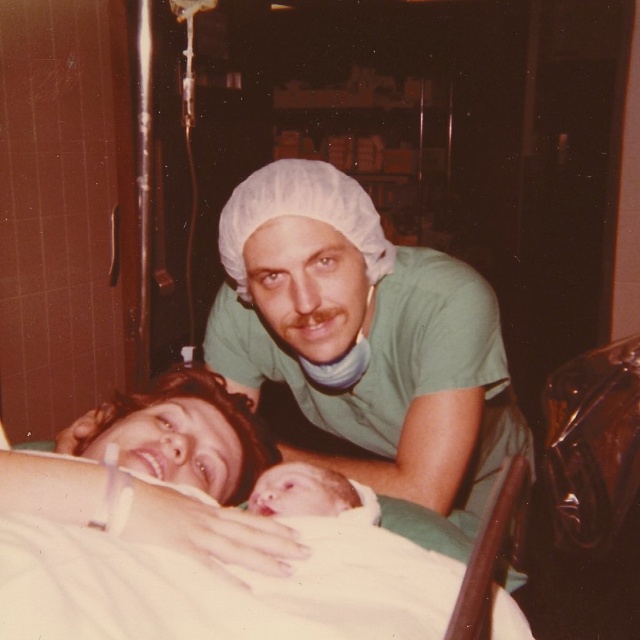
Between point (362, 225) and point (285, 497), which one is positioned in front?

Point (285, 497)

Does point (451, 316) lie in front of point (275, 500)?

No, it is behind (275, 500).

Who is more forward, (356, 211) or (316, 497)?

Positioned in front is point (316, 497).

Where is `green smooth shirt at upper center`? Image resolution: width=640 pixels, height=640 pixels. green smooth shirt at upper center is located at coordinates (364, 337).

Between green smooth shirt at upper center and smooth skin face at center, which one appears on the right side from the viewer's perspective?

From the viewer's perspective, green smooth shirt at upper center appears more on the right side.

Is point (492, 474) positioned behind point (170, 433)?

Yes.

Is point (508, 406) positioned before point (236, 403)?

No, it is behind (236, 403).

In order to click on green smooth shirt at upper center in this screenshot , I will do `click(364, 337)`.

Does smooth skin face at center appear on the right side of smooth skin newborn at center?

In fact, smooth skin face at center is to the left of smooth skin newborn at center.

Does smooth skin face at center have a greater width compared to smooth skin newborn at center?

Indeed, smooth skin face at center has a greater width compared to smooth skin newborn at center.

Locate an element on the screen. smooth skin face at center is located at coordinates (182, 435).